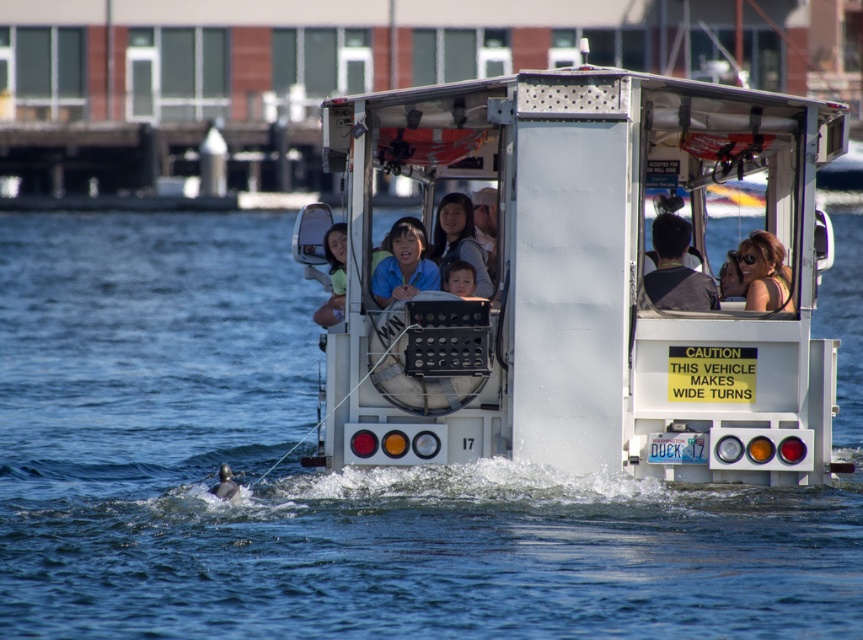
You are a tour guide on a Duck vehicle and want to ensure passengers can see the water clearly. Since both the clear blue water at center and matte black sunglasses at center are at the center, which object is bigger and might block the view?

The clear blue water at center has a larger size compared to matte black sunglasses at center, so the sunglasses might block the view less since they are smaller.

You are a passenger in the amphibious Duck vehicle. You notice the clear blue water at center and the matte black sunglasses at center. Which object is closer to your eyes?

The matte black sunglasses at center are closer to your eyes because the clear blue water at center is located below them.